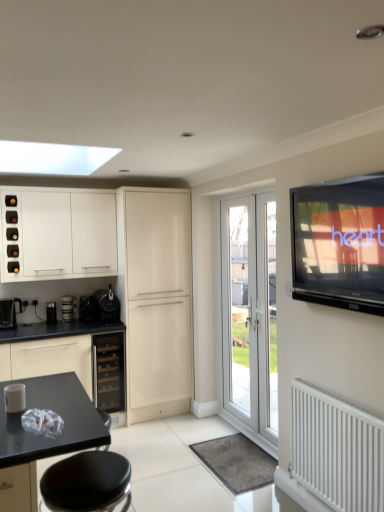
In order to click on vacant area on top of white metal radiator at lower right (from a real-world perspective) in this screenshot , I will do `click(339, 391)`.